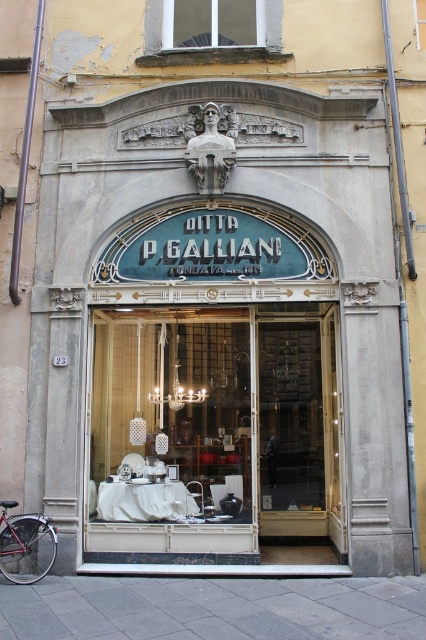
Between white glass window at upper center and shiny red bicycle at lower left, which one is positioned higher?

white glass window at upper center

Which is in front, point (184, 12) or point (51, 529)?

Point (51, 529) is more forward.

The height and width of the screenshot is (640, 426). I want to click on white glass window at upper center, so (x=212, y=22).

Does gold/glass door at center appear on the left side of white glass window at upper center?

No, gold/glass door at center is not to the left of white glass window at upper center.

Does gold/glass door at center have a lesser height compared to white glass window at upper center?

In fact, gold/glass door at center may be taller than white glass window at upper center.

Who is more forward, (336, 452) or (210, 16)?

Point (336, 452) is in front.

This screenshot has height=640, width=426. I want to click on gold/glass door at center, so click(x=299, y=424).

Is gold/glass door at center wider than shiny red bicycle at lower left?

Correct, the width of gold/glass door at center exceeds that of shiny red bicycle at lower left.

Where is `gold/glass door at center`? gold/glass door at center is located at coordinates point(299,424).